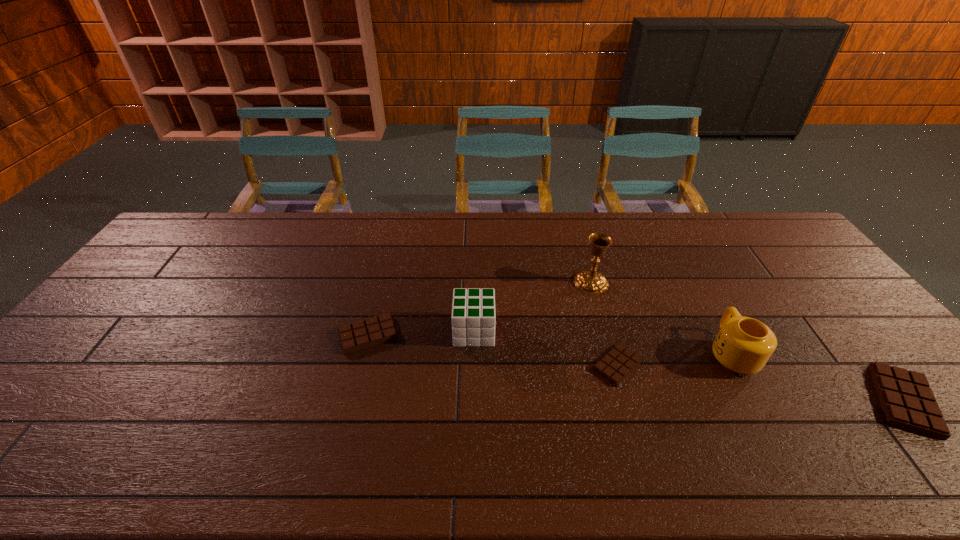
You are a GUI agent. You are given a task and a screenshot of the screen. Output one action in this format:
    pyautogui.click(x=<x>, y=<y>)
    Task: Click on the leftmost object
    
    Given the screenshot: What is the action you would take?
    pyautogui.click(x=358, y=335)

The image size is (960, 540). Identify the location of the fifth tallest object. (358, 335).

The width and height of the screenshot is (960, 540). Identify the location of the shortest candy bar. (620, 361).

At what (x,y) coordinates should I click in order to perform the action: click on the shortest object. Please return your answer as a coordinate pair (x, y). Looking at the image, I should click on (620, 361).

The height and width of the screenshot is (540, 960). Identify the location of the farthest object. (591, 282).

Image resolution: width=960 pixels, height=540 pixels. In order to click on chalice in this screenshot , I will do `click(591, 282)`.

Where is `the fifth object from right to left`? This screenshot has height=540, width=960. the fifth object from right to left is located at coordinates (473, 317).

I want to click on mug, so click(x=744, y=345).

Image resolution: width=960 pixels, height=540 pixels. I want to click on free space located 0.090m on the left of the leftmost candy bar, so click(x=305, y=335).

Where is `vacant space located on the right of the shortest object`? vacant space located on the right of the shortest object is located at coordinates (774, 365).